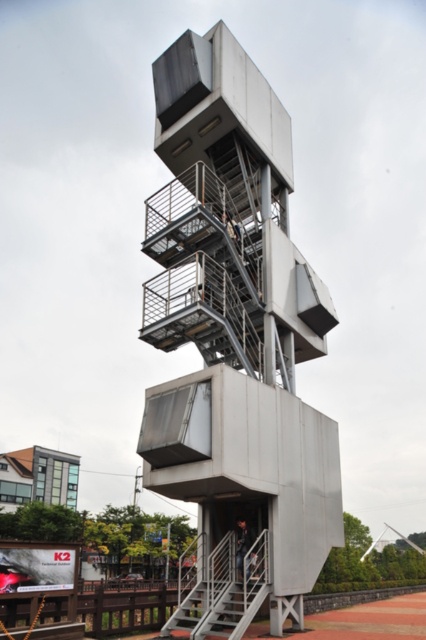
You are a visitor standing at the base of the structure and want to reach the top. Which object, the metallic silver observation tower at center or the metallic gray stairs at center, should you use to ascend?

You should use the metallic gray stairs at center to ascend because the metallic silver observation tower at center is a larger structure and likely serves as the destination rather than the pathway.

You are standing at the entrance of the modern architectural structure and want to reach the metallic silver observation tower at center. According to the coordinates provided, is the tower positioned more towards the north or south direction from your current location?

The metallic silver observation tower at center is located at point (x=236, y=333), which means it is positioned slightly north of the center point. Since you are at the entrance, which is likely at the base of the structure, the tower would be more towards the north direction from your current location.